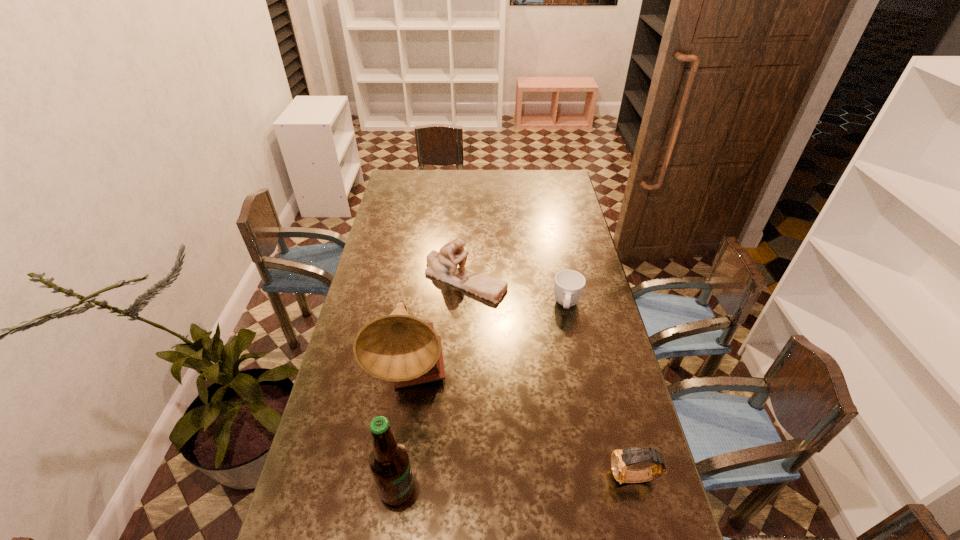
The height and width of the screenshot is (540, 960). What are the coordinates of `free spot located on the front-facing side of the third shortest object` in the screenshot? It's located at (504, 382).

Image resolution: width=960 pixels, height=540 pixels. I want to click on vacant point located 0.340m on the front-facing side of the third shortest object, so [x=502, y=377].

Where is `blank area located 0.200m on the front-facing side of the third shortest object`? Image resolution: width=960 pixels, height=540 pixels. blank area located 0.200m on the front-facing side of the third shortest object is located at coordinates (491, 343).

I want to click on free point located with the handle on the side of the cup, so click(560, 414).

Identify the location of free space located 0.260m with the handle on the side of the cup. The width and height of the screenshot is (960, 540). (562, 380).

You are a GUI agent. You are given a task and a screenshot of the screen. Output one action in this format:
    pyautogui.click(x=<x>, y=<y>)
    Task: Click on the free location located 0.140m with the handle on the side of the cup
    This screenshot has width=960, height=540.
    Given the screenshot: What is the action you would take?
    pyautogui.click(x=564, y=350)

Locate an element on the screen. The height and width of the screenshot is (540, 960). free location located 0.060m on the horn of the phonograph record is located at coordinates (443, 422).

The image size is (960, 540). Find the location of `free space located on the horn of the phonograph record`. free space located on the horn of the phonograph record is located at coordinates pyautogui.click(x=441, y=419).

Find the location of a particular element. Image resolution: width=960 pixels, height=540 pixels. vacant space located on the horn of the phonograph record is located at coordinates (469, 456).

What are the coordinates of `object located in the left edge section of the desktop` in the screenshot? It's located at (398, 347).